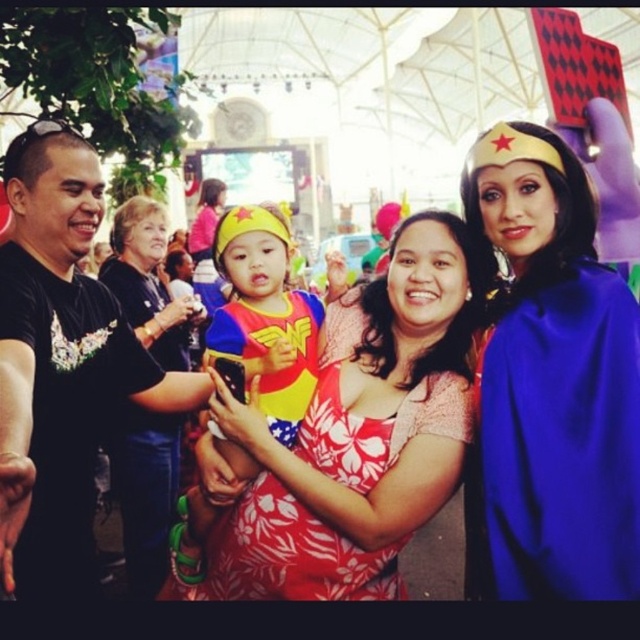
Is point (410, 417) closer to viewer compared to point (282, 372)?

That is True.

Does matte red dress at center have a greater height compared to matte yellow headband at center?

Yes.

The height and width of the screenshot is (640, 640). In order to click on matte red dress at center in this screenshot , I will do `click(352, 440)`.

Identify the location of matte red dress at center. The width and height of the screenshot is (640, 640). (352, 440).

Is matte red dress at center shorter than black matte t-shirt at left?

Yes, matte red dress at center is shorter than black matte t-shirt at left.

Which is behind, point (209, 541) or point (74, 524)?

The point (74, 524) is more distant.

The image size is (640, 640). I want to click on matte red dress at center, so click(x=352, y=440).

Between blue satin cape at center and matte red dress at center, which one has less height?

With less height is matte red dress at center.

Who is more forward, (547, 321) or (339, 552)?

Point (547, 321)

Describe the element at coordinates (550, 381) in the screenshot. I see `blue satin cape at center` at that location.

The height and width of the screenshot is (640, 640). Find the location of `blue satin cape at center`. blue satin cape at center is located at coordinates (550, 381).